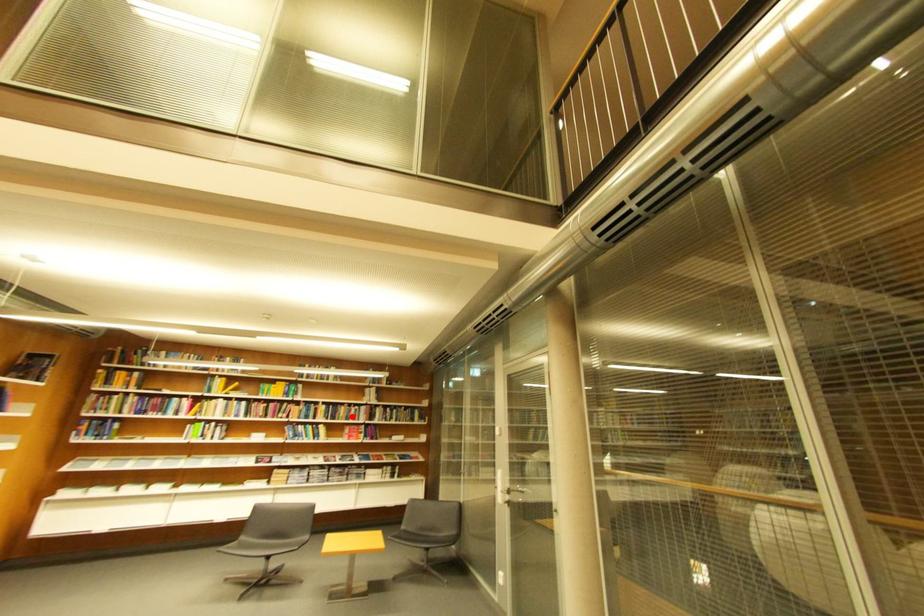
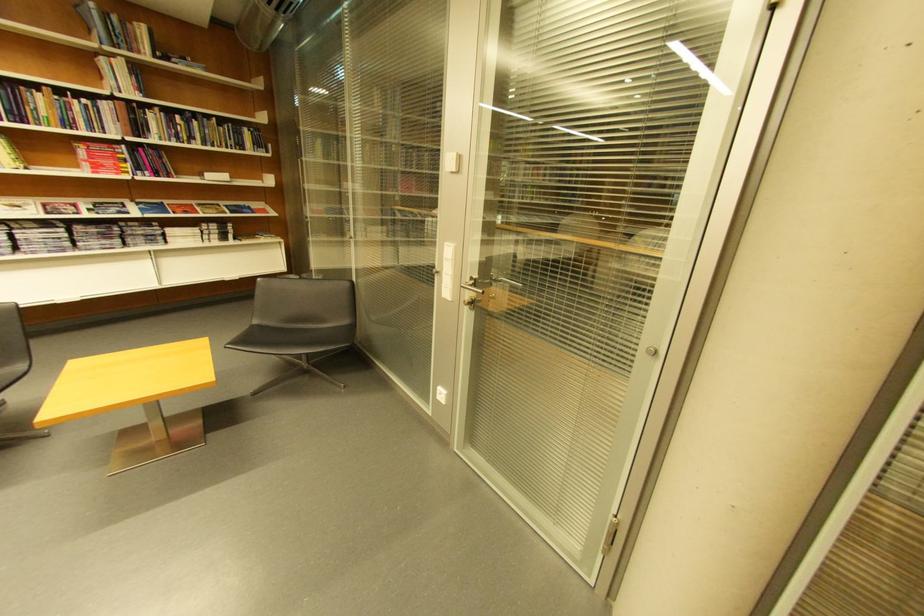
Where in the second image is the point corresponding to the highlighted location from the first image?

(54, 116)